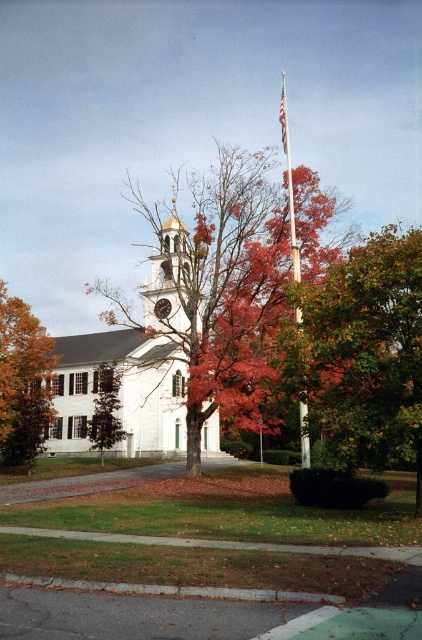
Is white matte church at center behind white fabric flag at center?

No, white matte church at center is closer to the viewer.

Does point (91, 362) come behind point (284, 125)?

No.

Find the location of `white matte church at center`. white matte church at center is located at coordinates (129, 371).

Who is positioned more to the right, white matte church at center or orange leafy tree at left?

white matte church at center is more to the right.

Who is positioned more to the left, white matte church at center or orange leafy tree at left?

orange leafy tree at left is more to the left.

What do you see at coordinates (129, 371) in the screenshot? I see `white matte church at center` at bounding box center [129, 371].

This screenshot has height=640, width=422. In order to click on white matte church at center in this screenshot , I will do `click(129, 371)`.

Based on the photo, does autumn leaves at center have a greater width compared to white smooth flag pole at center?

Yes, autumn leaves at center is wider than white smooth flag pole at center.

Can you confirm if autumn leaves at center is taller than white smooth flag pole at center?

In fact, autumn leaves at center may be shorter than white smooth flag pole at center.

Locate an element on the screen. The width and height of the screenshot is (422, 640). autumn leaves at center is located at coordinates (232, 278).